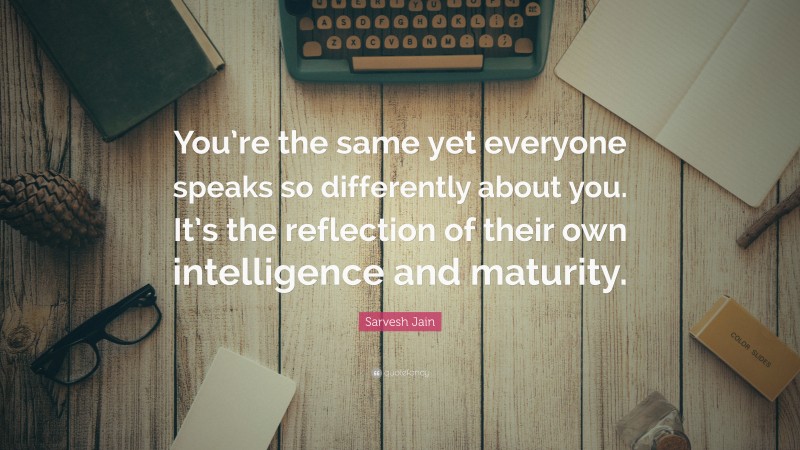
At what (x,y) coordinates should I click in order to perform the action: click on wooden surface. Please return your answer as a coordinate pair (x, y). This screenshot has width=800, height=450. Looking at the image, I should click on (293, 320).